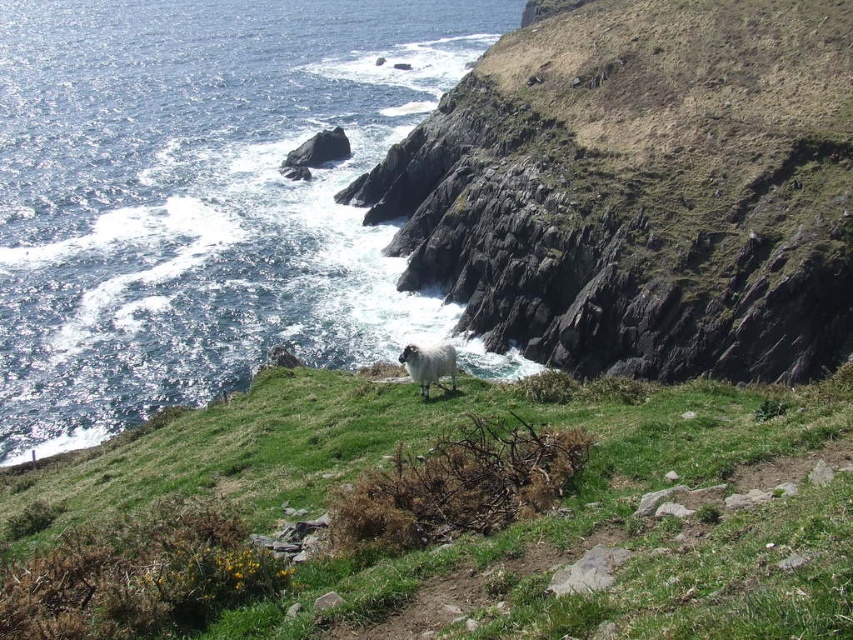
Is blue liquid water at upper left below grassy hillside at upper right?

Actually, blue liquid water at upper left is above grassy hillside at upper right.

Identify the location of blue liquid water at upper left. (200, 195).

Is point (28, 216) closer to viewer compared to point (657, 113)?

No, it is behind (657, 113).

Where is `blue liquid water at upper left`? The image size is (853, 640). blue liquid water at upper left is located at coordinates [200, 195].

Which is more to the left, green grassy at upper center or grassy hillside at upper right?

green grassy at upper center

Image resolution: width=853 pixels, height=640 pixels. What do you see at coordinates (457, 513) in the screenshot?
I see `green grassy at upper center` at bounding box center [457, 513].

Find the location of a particular element. The width and height of the screenshot is (853, 640). green grassy at upper center is located at coordinates (457, 513).

From the picture: Can you confirm if green grassy at upper center is wider than white woolly sheep at center?

Yes, green grassy at upper center is wider than white woolly sheep at center.

Who is shorter, green grassy at upper center or white woolly sheep at center?

Standing shorter between the two is white woolly sheep at center.

Identify the location of green grassy at upper center. (457, 513).